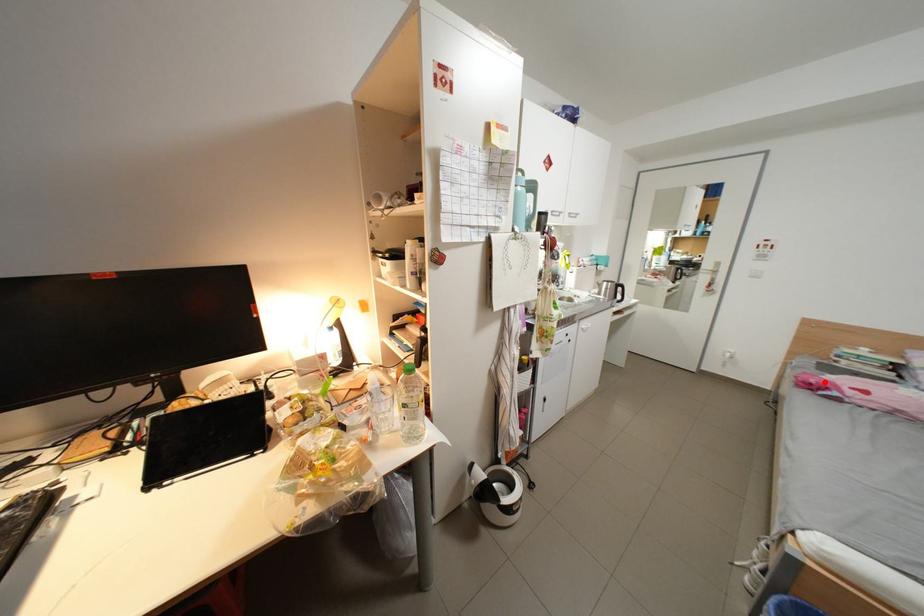
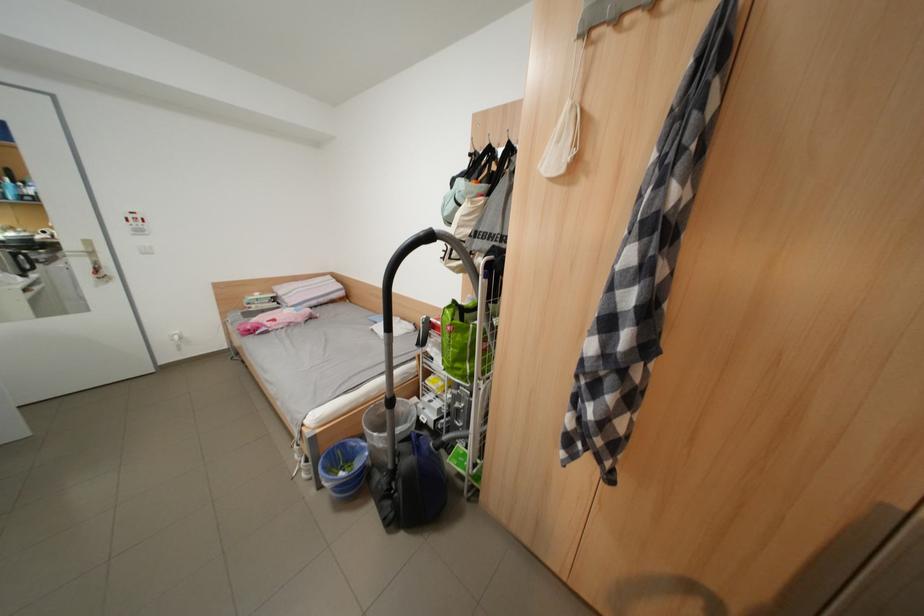
Locate, in the second image, the point that corresponds to the highlighted location in the first image.

(261, 329)